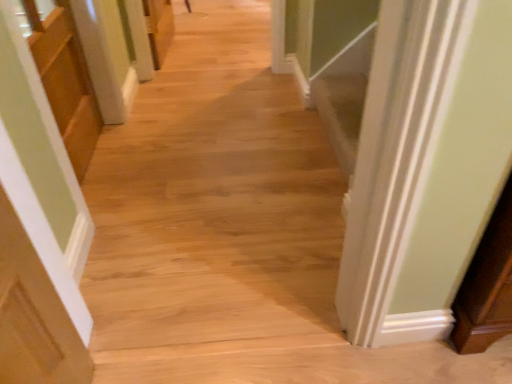
Question: From a real-world perspective, is matte wood cabinet at left positioned above or below natural wood floor at center?

Choices:
 (A) above
 (B) below

Answer: (B)

Question: From their relative heights in the image, would you say matte wood cabinet at left is taller or shorter than natural wood floor at center?

Choices:
 (A) short
 (B) tall

Answer: (A)

Question: From the image's perspective, is matte wood cabinet at left positioned above or below natural wood floor at center?

Choices:
 (A) above
 (B) below

Answer: (A)

Question: Considering their positions, is natural wood floor at center located in front of or behind matte wood cabinet at left?

Choices:
 (A) front
 (B) behind

Answer: (A)

Question: From a real-world perspective, relative to matte wood cabinet at left, is natural wood floor at center vertically above or below?

Choices:
 (A) above
 (B) below

Answer: (A)

Question: From the image's perspective, is natural wood floor at center located above or below matte wood cabinet at left?

Choices:
 (A) below
 (B) above

Answer: (A)

Question: Considering the positions of natural wood floor at center and matte wood cabinet at left in the image, is natural wood floor at center wider or thinner than matte wood cabinet at left?

Choices:
 (A) thin
 (B) wide

Answer: (B)